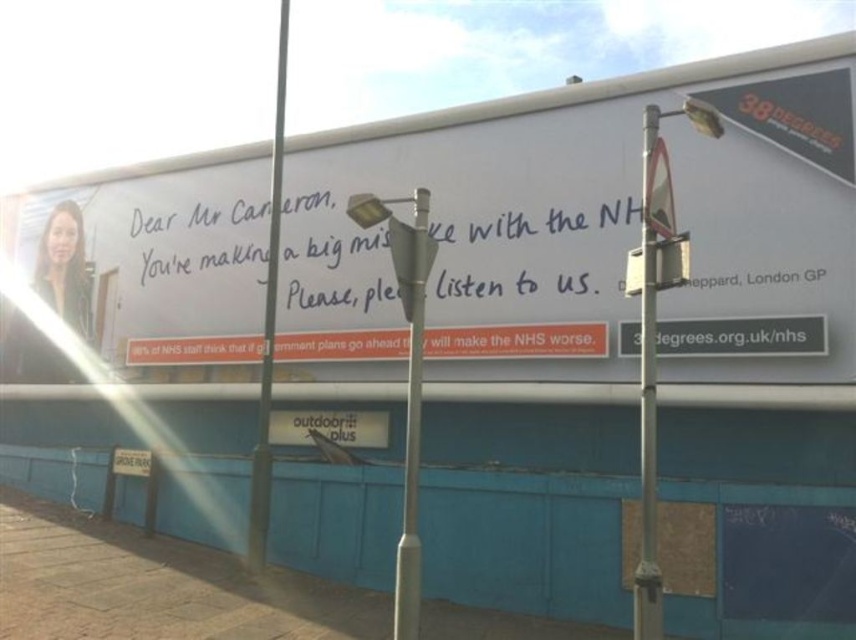
Question: Does metallic silver pole at right have a greater width compared to black plastic sign at lower center?

Choices:
 (A) no
 (B) yes

Answer: (A)

Question: Is white paper billboard at upper center above metallic gray pole at center?

Choices:
 (A) no
 (B) yes

Answer: (B)

Question: Which of the following is the farthest from the observer?

Choices:
 (A) metallic silver pole at right
 (B) white paper billboard at upper center
 (C) metallic gray pole at center

Answer: (B)

Question: Which object appears farthest from the camera in this image?

Choices:
 (A) metallic gray pole at center
 (B) black plastic sign at lower center
 (C) white paper billboard at upper center

Answer: (B)

Question: Can you confirm if metallic silver pole at right is thinner than metallic gray pole at center?

Choices:
 (A) yes
 (B) no

Answer: (A)

Question: Among these points, which one is farthest from the camera?

Choices:
 (A) (646, 125)
 (B) (376, 442)
 (C) (268, 236)

Answer: (C)